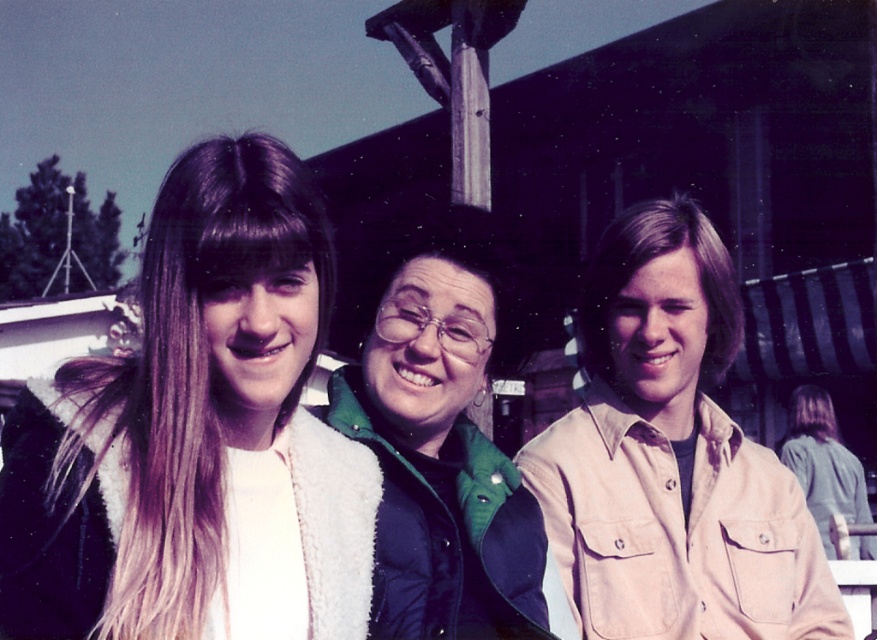
Question: Which point is closer to the camera taking this photo?

Choices:
 (A) (732, 346)
 (B) (371, 448)

Answer: (B)

Question: Which of the following is the farthest from the observer?

Choices:
 (A) white fleece jacket at left
 (B) beige cotton shirt at center
 (C) green fuzzy vest at center

Answer: (B)

Question: Can you confirm if white fleece jacket at left is positioned below green fuzzy vest at center?

Choices:
 (A) yes
 (B) no

Answer: (B)

Question: Can you confirm if white fleece jacket at left is smaller than green fuzzy vest at center?

Choices:
 (A) no
 (B) yes

Answer: (B)

Question: Which object is positioned farthest from the beige cotton shirt at center?

Choices:
 (A) green fuzzy vest at center
 (B) white fleece jacket at left

Answer: (B)

Question: Considering the relative positions of beige cotton shirt at center and green fuzzy vest at center in the image provided, where is beige cotton shirt at center located with respect to green fuzzy vest at center?

Choices:
 (A) below
 (B) above

Answer: (A)